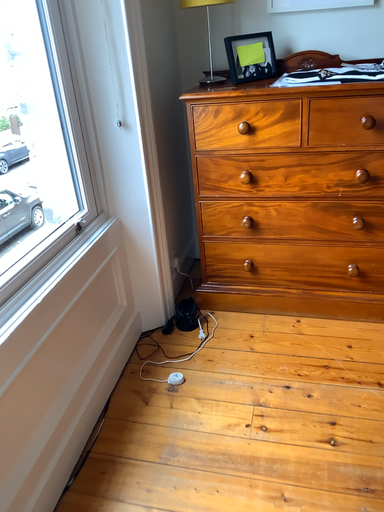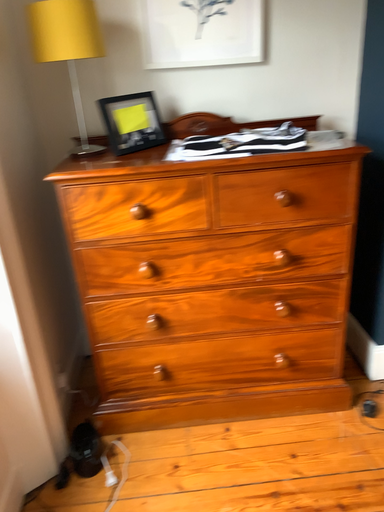
Question: How did the camera likely rotate when shooting the video?

Choices:
 (A) rotated right
 (B) rotated left

Answer: (A)